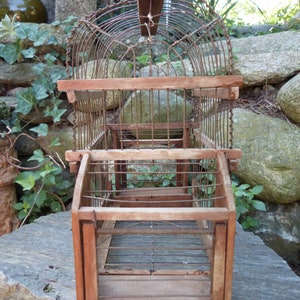
In order to click on light in this screenshot , I will do `click(251, 19)`.